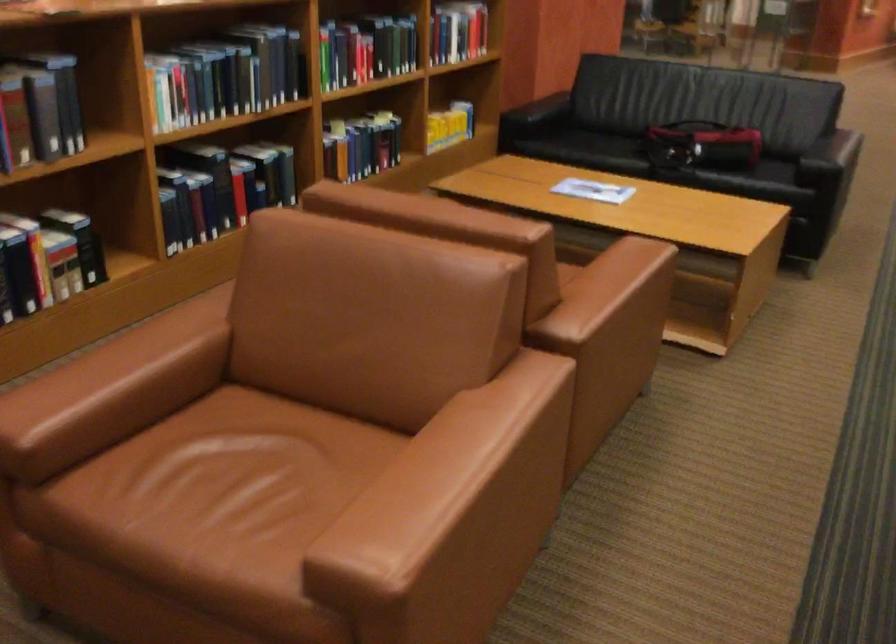
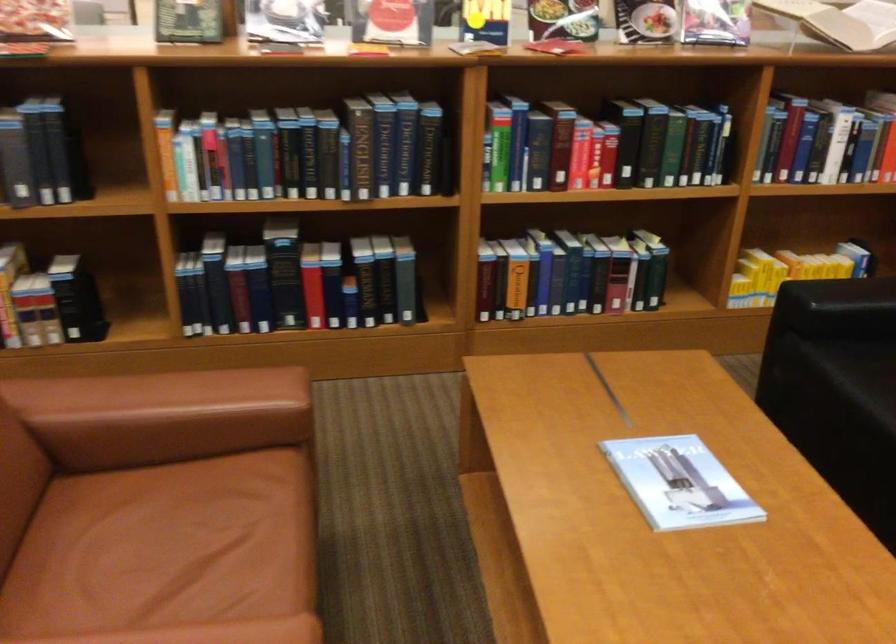
Where in the second image is the point corresponding to the point at 596,190 from the first image?

(678, 483)